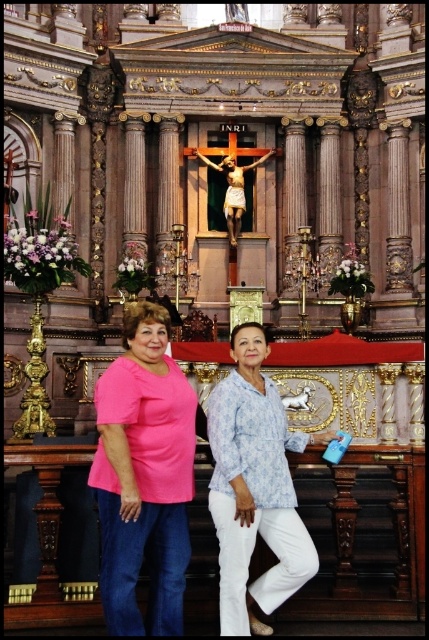
Is pink matte shirt at center below blue printed blouse at center?

Correct, pink matte shirt at center is located below blue printed blouse at center.

Who is lower down, pink matte shirt at center or blue printed blouse at center?

pink matte shirt at center

Which is in front, point (105, 566) or point (232, 524)?

Point (105, 566) is in front.

You are a GUI agent. You are given a task and a screenshot of the screen. Output one action in this format:
    pyautogui.click(x=<x>, y=<y>)
    Task: Click on the pink matte shirt at center
    The height and width of the screenshot is (640, 429).
    Given the screenshot: What is the action you would take?
    pyautogui.click(x=144, y=476)

Which is behind, point (289, 563) or point (223, 468)?

The point (223, 468) is more distant.

Between pink fabric shirt at center and blue printed blouse at center, which one has less height?

Standing shorter between the two is blue printed blouse at center.

Find the location of a particular element. The width and height of the screenshot is (429, 640). pink fabric shirt at center is located at coordinates click(139, 451).

Who is positioned more to the left, pink fabric shirt at center or pink matte shirt at center?

pink matte shirt at center

Between point (244, 516) and point (154, 332), which one is positioned behind?

The point (154, 332) is behind.

I want to click on pink fabric shirt at center, so click(139, 451).